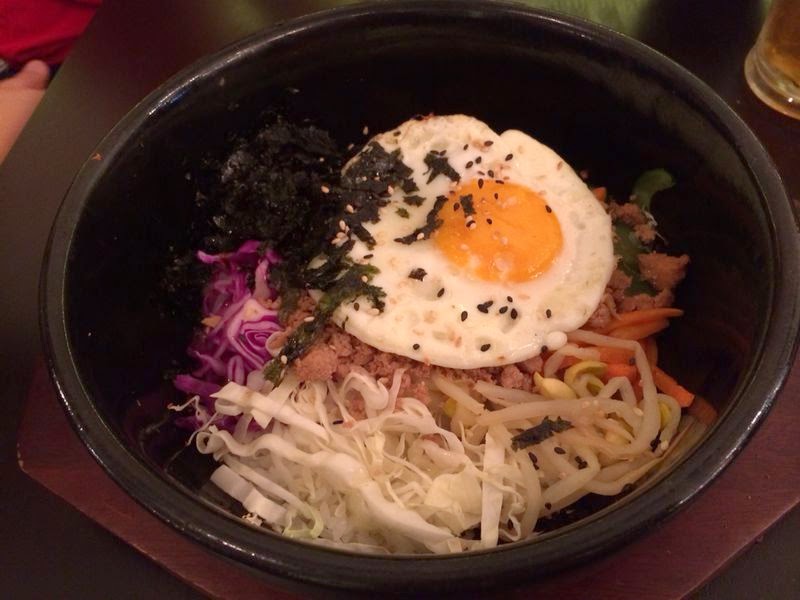
This screenshot has height=600, width=800. Find the location of `wooden table`. wooden table is located at coordinates (69, 482), (105, 73), (718, 533).